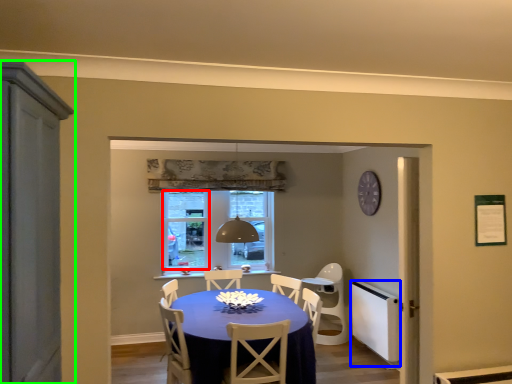
Question: Estimate the real-world distances between objects in this image. Which object is farther from window screen (highlighted by a red box), appliance (highlighted by a blue box) or cabinetry (highlighted by a green box)?

Choices:
 (A) appliance
 (B) cabinetry

Answer: (B)